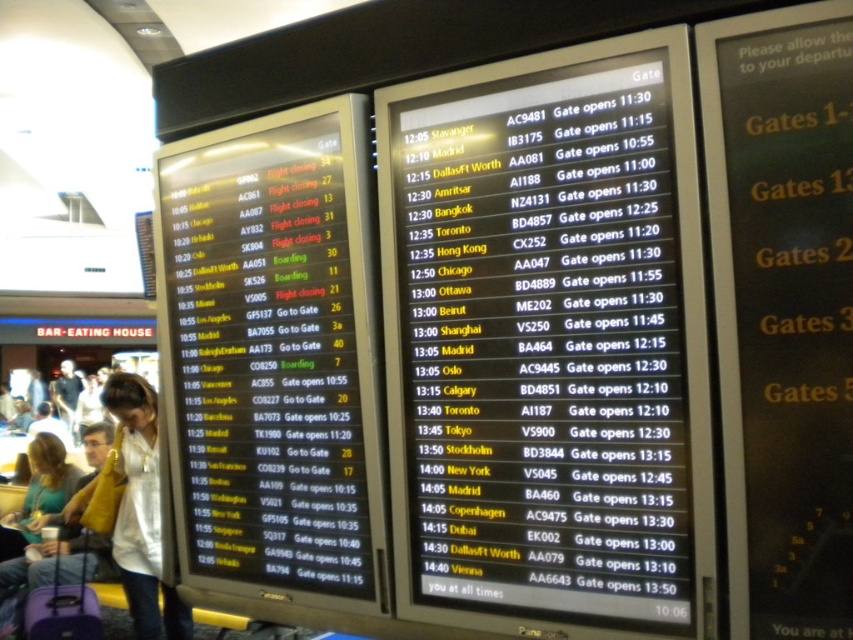
You are standing in front of the two flight information boards in the airport terminal. You notice two points marked on the boards at coordinates point (457, 349) and point (267, 154). Which of these points is physically closer to you?

Point (457, 349) is closer to the viewer than point (267, 154).